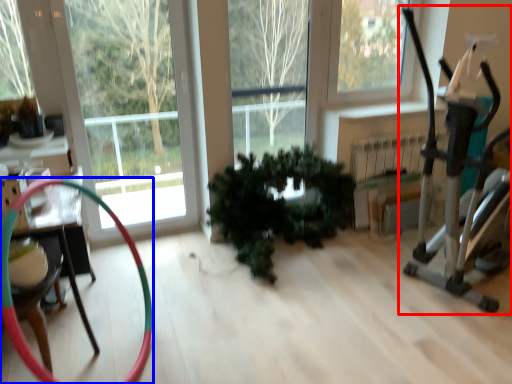
Question: Which object is further to the camera taking this photo, baby carriage (highlighted by a red box) or garden hose (highlighted by a blue box)?

Choices:
 (A) baby carriage
 (B) garden hose

Answer: (A)